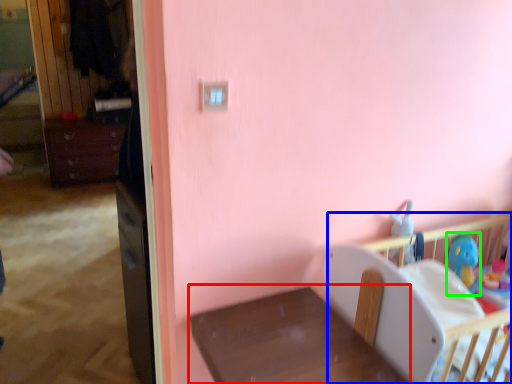
Question: Estimate the real-world distances between objects in this image. Which object is farther from furniture (highlighted by a red box), infant bed (highlighted by a blue box) or toy (highlighted by a green box)?

Choices:
 (A) infant bed
 (B) toy

Answer: (B)